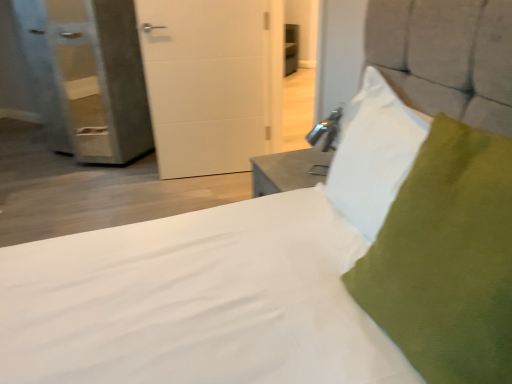
Question: Is white matte door at center at the left side of textured gray pillow at upper right, the 2th pillow when ordered from front to back?

Choices:
 (A) yes
 (B) no

Answer: (A)

Question: Does white matte door at center have a lesser height compared to textured gray pillow at upper right, the 2th pillow when ordered from front to back?

Choices:
 (A) yes
 (B) no

Answer: (B)

Question: Is white matte door at center positioned beyond the bounds of textured gray pillow at upper right, the 2th pillow when ordered from front to back?

Choices:
 (A) yes
 (B) no

Answer: (A)

Question: Does white matte door at center have a greater height compared to textured gray pillow at upper right, the 2th pillow when ordered from front to back?

Choices:
 (A) no
 (B) yes

Answer: (B)

Question: Is white matte door at center not close to textured gray pillow at upper right, the 2th pillow when ordered from front to back?

Choices:
 (A) no
 (B) yes

Answer: (B)

Question: Is textured gray pillow at upper right, the 2th pillow when ordered from front to back, in front of or behind white matte door at center in the image?

Choices:
 (A) front
 (B) behind

Answer: (A)

Question: In the image, is textured gray pillow at upper right, which ranks as the 1th pillow in back-to-front order, on the left side or the right side of white matte door at center?

Choices:
 (A) right
 (B) left

Answer: (A)

Question: Is textured gray pillow at upper right, which ranks as the 1th pillow in back-to-front order, taller or shorter than white matte door at center?

Choices:
 (A) short
 (B) tall

Answer: (A)

Question: In terms of width, does textured gray pillow at upper right, the 2th pillow when ordered from front to back, look wider or thinner when compared to white matte door at center?

Choices:
 (A) wide
 (B) thin

Answer: (A)

Question: Is green fabric pillow at upper right, placed as the second pillow when sorted from back to front, wider or thinner than textured gray pillow at upper right, which ranks as the 1th pillow in back-to-front order?

Choices:
 (A) thin
 (B) wide

Answer: (B)

Question: Considering the positions of green fabric pillow at upper right, acting as the first pillow starting from the front, and textured gray pillow at upper right, the 2th pillow when ordered from front to back, in the image, is green fabric pillow at upper right, acting as the first pillow starting from the front, bigger or smaller than textured gray pillow at upper right, the 2th pillow when ordered from front to back,?

Choices:
 (A) big
 (B) small

Answer: (A)

Question: In the image, is green fabric pillow at upper right, acting as the first pillow starting from the front, positioned in front of or behind textured gray pillow at upper right, the 2th pillow when ordered from front to back?

Choices:
 (A) behind
 (B) front

Answer: (B)

Question: In terms of height, does green fabric pillow at upper right, acting as the first pillow starting from the front, look taller or shorter compared to textured gray pillow at upper right, the 2th pillow when ordered from front to back?

Choices:
 (A) short
 (B) tall

Answer: (B)

Question: Would you say textured gray pillow at upper right, which ranks as the 1th pillow in back-to-front order, is to the left or to the right of green fabric pillow at upper right, acting as the first pillow starting from the front, in the picture?

Choices:
 (A) right
 (B) left

Answer: (B)

Question: From the image's perspective, relative to green fabric pillow at upper right, acting as the first pillow starting from the front, is textured gray pillow at upper right, which ranks as the 1th pillow in back-to-front order, above or below?

Choices:
 (A) above
 (B) below

Answer: (A)